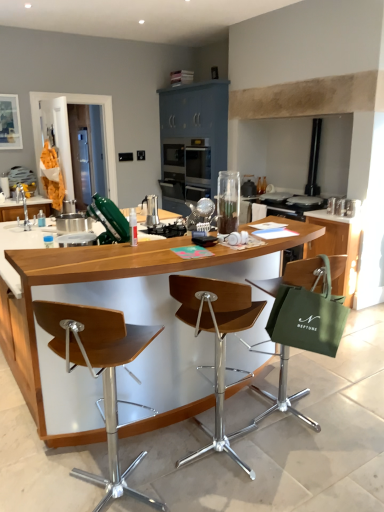
Question: Considering the relative positions of satin silver coffee maker at center and green fabric chair at right, the first chair when ordered from right to left, in the image provided, is satin silver coffee maker at center to the left or to the right of green fabric chair at right, the first chair when ordered from right to left,?

Choices:
 (A) right
 (B) left

Answer: (B)

Question: Is satin silver coffee maker at center situated inside green fabric chair at right, which ranks as the 3th chair in left-to-right order, or outside?

Choices:
 (A) inside
 (B) outside

Answer: (B)

Question: Which is farther from the green fabric chair at right, which ranks as the 3th chair in left-to-right order?

Choices:
 (A) satin silver coffee maker at center
 (B) wooden seat at center, which is the 3th chair from right to left
 (C) green fabric shopping bag at right
 (D) wooden seat at center, which appears as the 2th chair when viewed from the left
 (E) green fabric bag at right, arranged as the first cabinetry when viewed from the right

Answer: (A)

Question: Which is nearer to the matte blue cabinet at center, which appears as the first cabinetry when viewed from the left?

Choices:
 (A) wooden seat at center, which appears as the 2th chair when viewed from the left
 (B) satin silver coffee maker at center
 (C) green fabric shopping bag at right
 (D) green fabric bag at right, arranged as the first cabinetry when viewed from the right
 (E) green fabric chair at right, which ranks as the 3th chair in left-to-right order

Answer: (B)